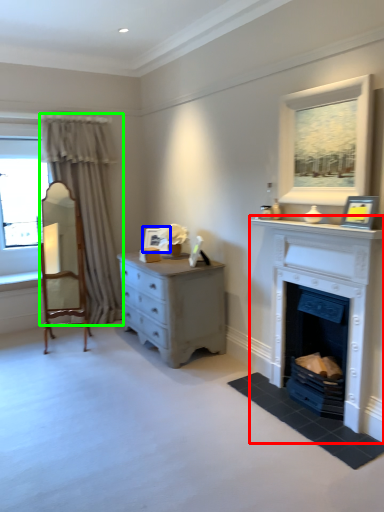
Question: Which object is positioned closest to fireplace (highlighted by a red box)? Select from picture frame (highlighted by a blue box) and curtain (highlighted by a green box).

Choices:
 (A) picture frame
 (B) curtain

Answer: (A)